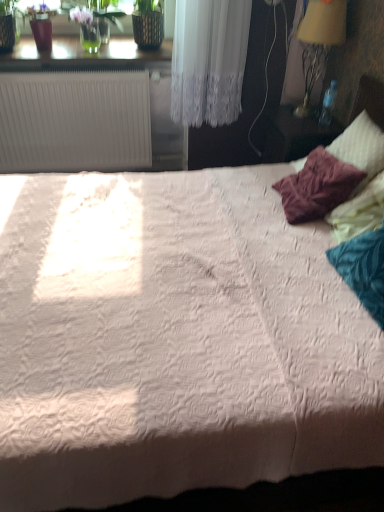
Question: Can yellow fabric lampshade at upper right be found inside matte wooden nightstand at right?

Choices:
 (A) no
 (B) yes

Answer: (A)

Question: Is there a large distance between matte wooden nightstand at right and yellow fabric lampshade at upper right?

Choices:
 (A) yes
 (B) no

Answer: (B)

Question: Is matte wooden nightstand at right positioned behind yellow fabric lampshade at upper right?

Choices:
 (A) no
 (B) yes

Answer: (B)

Question: Could you tell me if matte wooden nightstand at right is turned towards yellow fabric lampshade at upper right?

Choices:
 (A) no
 (B) yes

Answer: (A)

Question: From a real-world perspective, is matte wooden nightstand at right physically below yellow fabric lampshade at upper right?

Choices:
 (A) no
 (B) yes

Answer: (B)

Question: From a real-world perspective, is matte wooden nightstand at right on top of yellow fabric lampshade at upper right?

Choices:
 (A) yes
 (B) no

Answer: (B)

Question: Is white plastic radiator at upper left thinner than matte wooden nightstand at right?

Choices:
 (A) no
 (B) yes

Answer: (A)

Question: Considering the relative sizes of white plastic radiator at upper left and matte wooden nightstand at right in the image provided, is white plastic radiator at upper left wider than matte wooden nightstand at right?

Choices:
 (A) yes
 (B) no

Answer: (A)

Question: Is white plastic radiator at upper left at the right side of matte wooden nightstand at right?

Choices:
 (A) no
 (B) yes

Answer: (A)

Question: Is white plastic radiator at upper left beside matte wooden nightstand at right?

Choices:
 (A) no
 (B) yes

Answer: (A)

Question: Does white plastic radiator at upper left come in front of matte wooden nightstand at right?

Choices:
 (A) no
 (B) yes

Answer: (A)

Question: Does white plastic radiator at upper left appear on the left side of matte wooden nightstand at right?

Choices:
 (A) yes
 (B) no

Answer: (A)

Question: Does matte wooden nightstand at right appear on the right side of white plastic radiator at upper left?

Choices:
 (A) no
 (B) yes

Answer: (B)